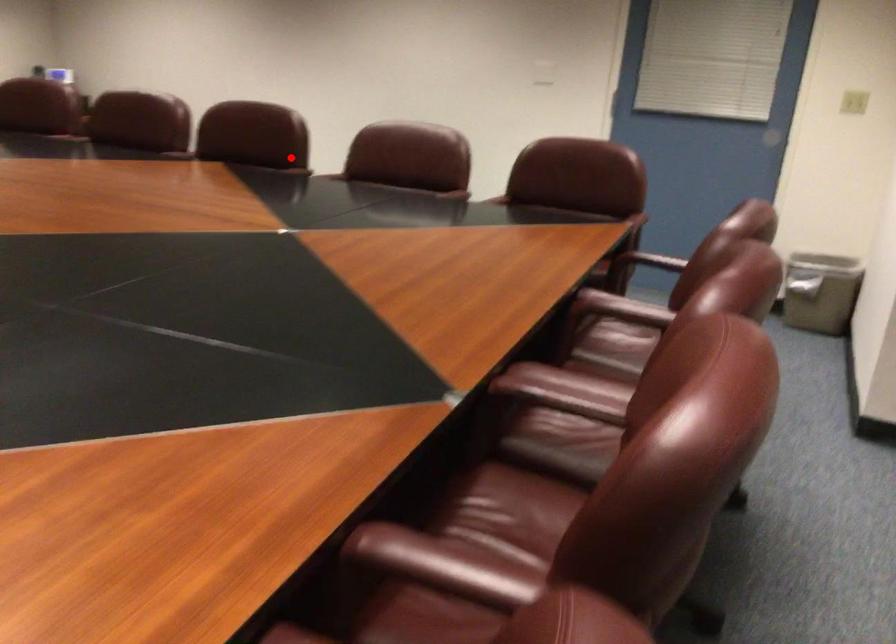
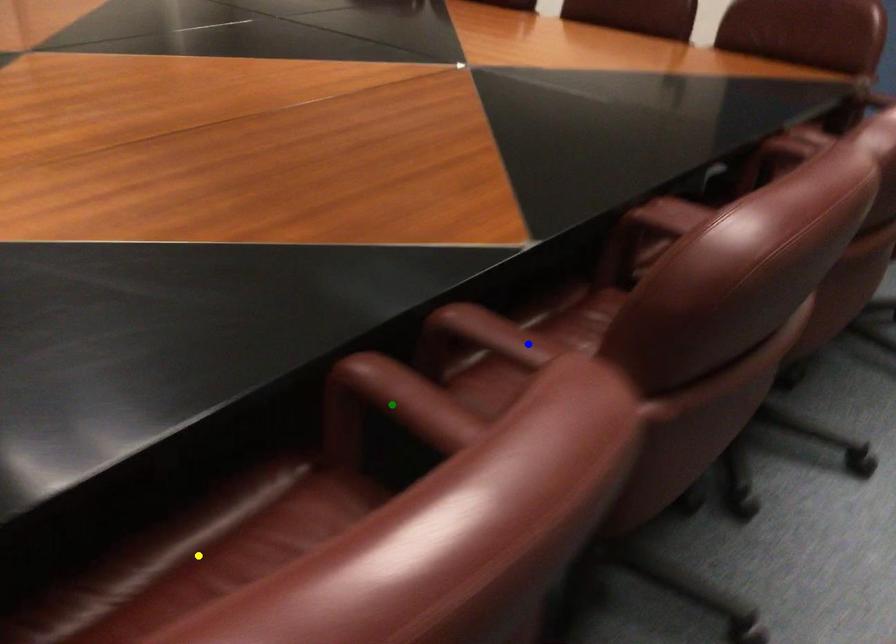
Question: I am providing you with two images of the same scene from different viewpoints. A red point is marked on the first image. You are given multiple points on the second image. In image 2, which mark is for the same physical point as the one in image 1?

Choices:
 (A) yellow point
 (B) green point
 (C) blue point

Answer: (C)